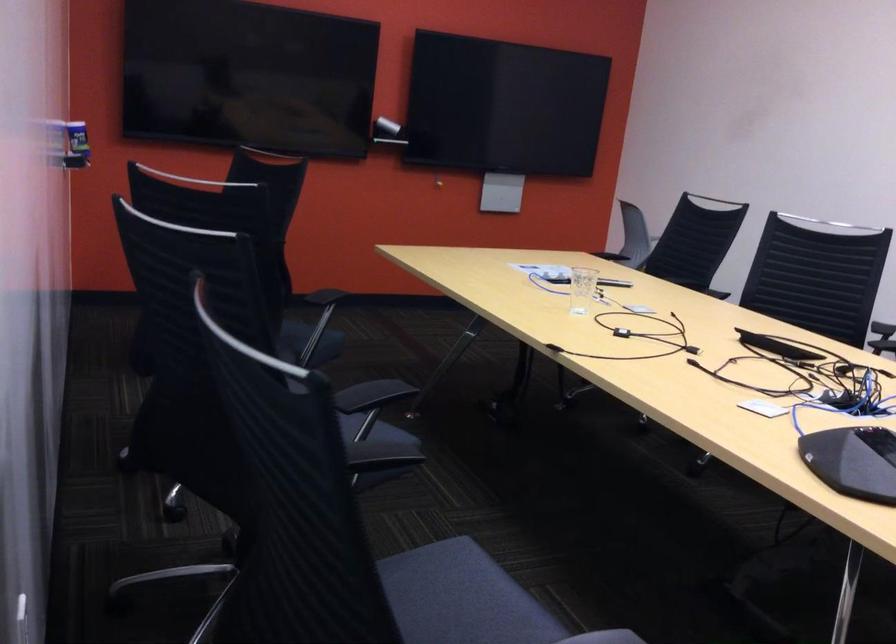
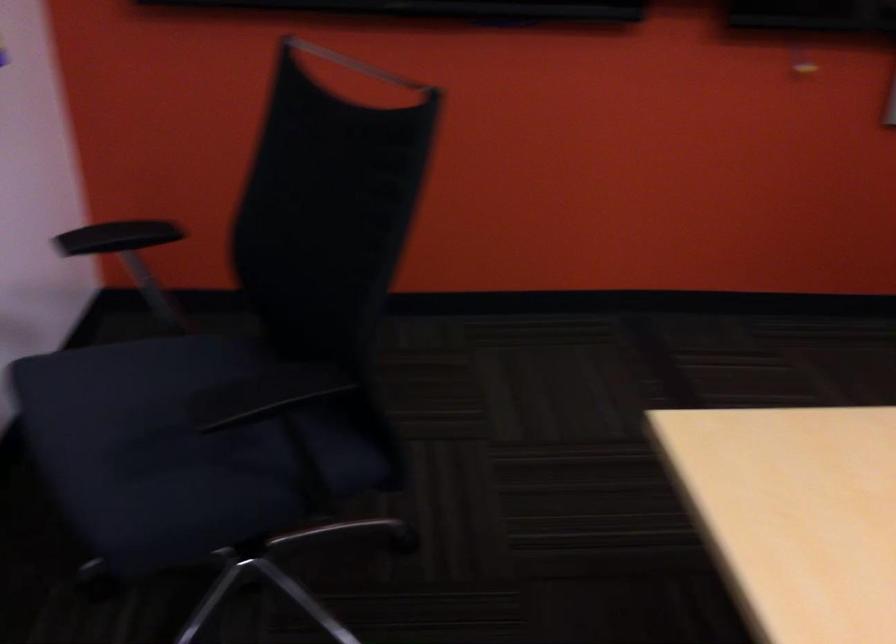
Find the pixel in the second image that matches (x=235, y=156) in the first image.

(356, 64)